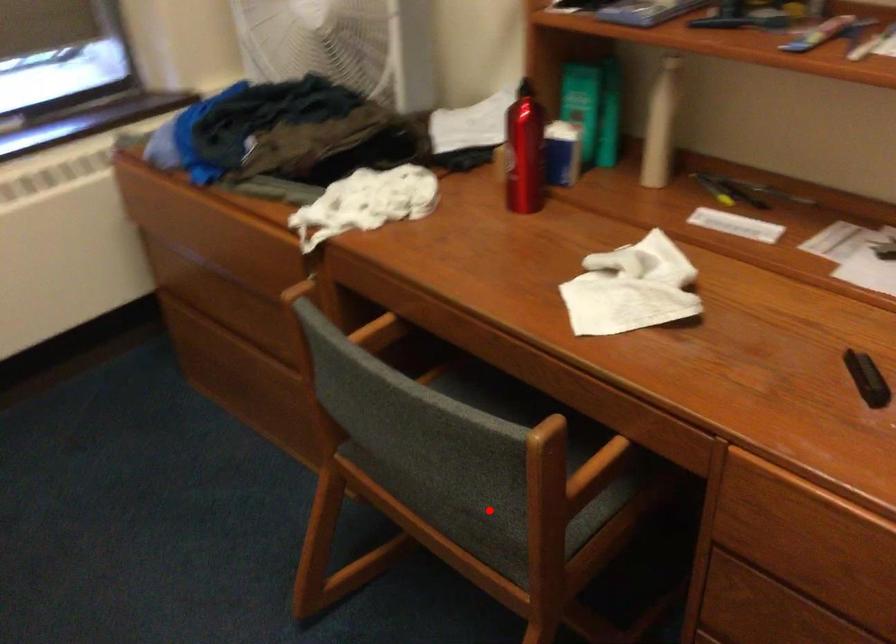
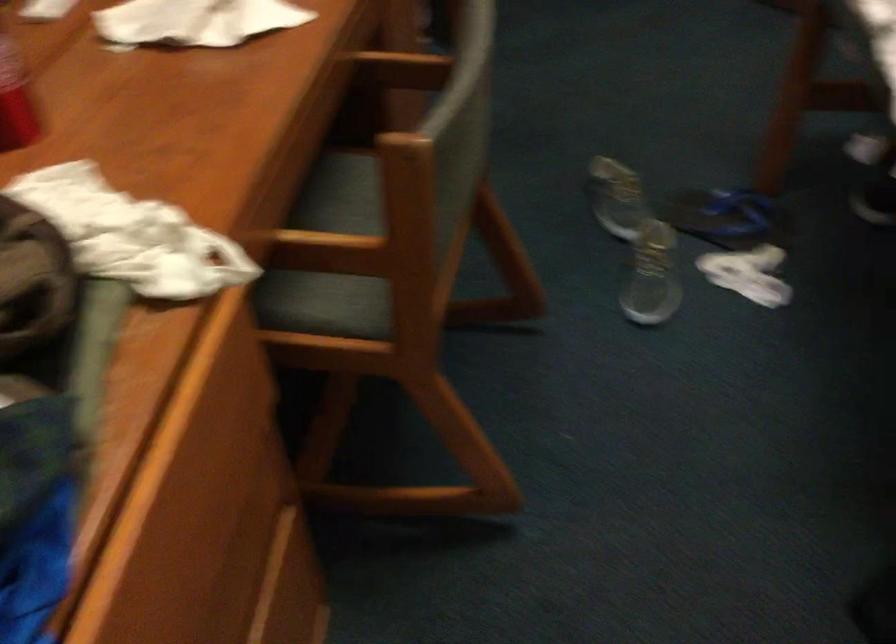
Question: I am providing you with two images of the same scene from different viewpoints. A red point is marked on the first image. At the location where the point appears in image 1, is it still visible in image 2?

Choices:
 (A) Yes
 (B) No

Answer: (B)